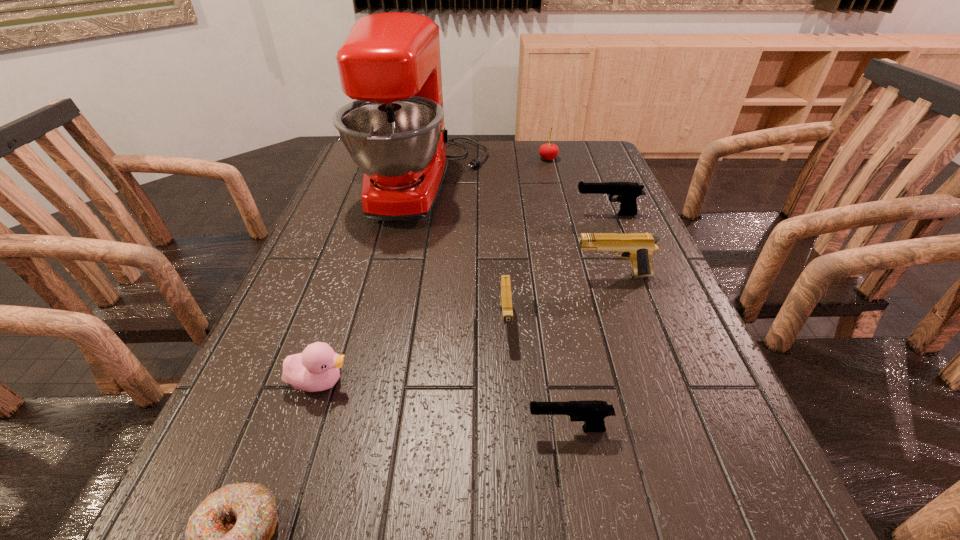
You are a GUI agent. You are given a task and a screenshot of the screen. Output one action in this format:
    pyautogui.click(x=<x>, y=<y>)
    Task: Click on the vacant space that satisfies the following two spatial constraints: 1. at the barrel of the smaller tan pistol; 2. on the front-facing side of the duckling
    This screenshot has height=540, width=960.
    Given the screenshot: What is the action you would take?
    pyautogui.click(x=509, y=382)